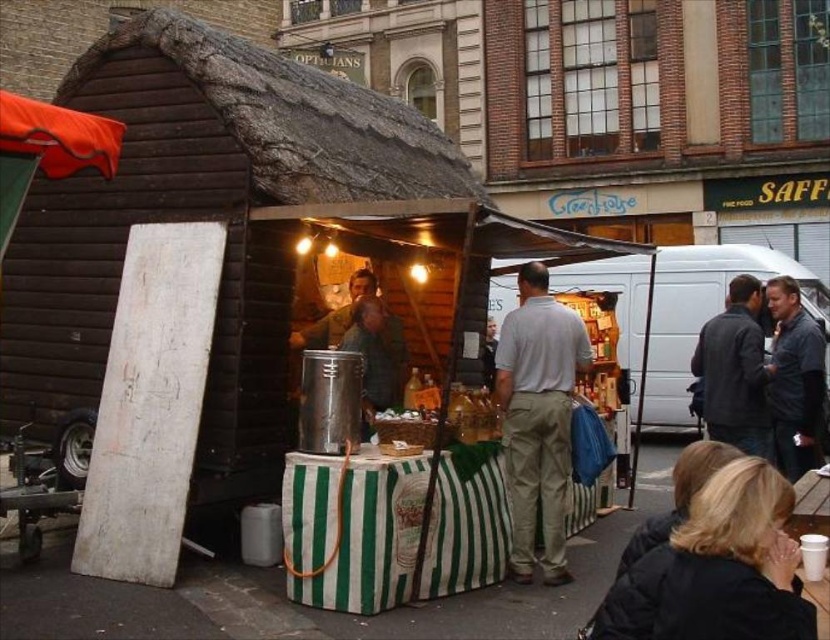
Question: Which point is closer to the camera?

Choices:
 (A) light gray cotton polo shirt at center
 (B) dark blue jacket at center
 (C) matte silver food truck at center

Answer: (A)

Question: Among these objects, which one is farthest from the camera?

Choices:
 (A) light gray cotton polo shirt at center
 (B) black jacket at lower right

Answer: (A)

Question: Is black jacket at lower right further to the viewer compared to matte silver food truck at center?

Choices:
 (A) no
 (B) yes

Answer: (A)

Question: Is matte silver food truck at center thinner than dark blue jacket at center?

Choices:
 (A) yes
 (B) no

Answer: (B)

Question: In this image, where is black jacket at lower right located relative to dark blue jacket at center?

Choices:
 (A) left
 (B) right

Answer: (A)

Question: Estimate the real-world distances between objects in this image. Which object is farther from the dark blue jacket at lower right?

Choices:
 (A) light gray cotton polo shirt at center
 (B) black jacket at lower right

Answer: (B)